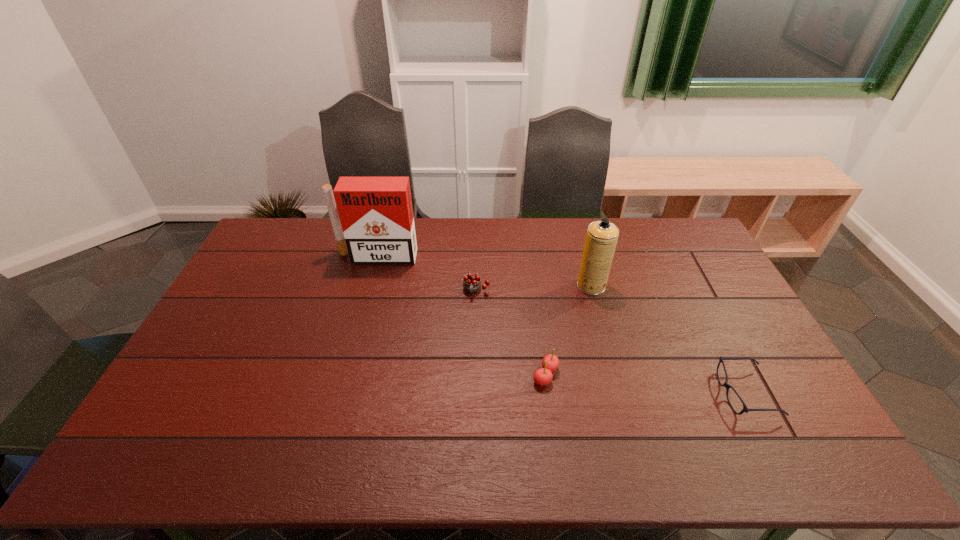
I want to click on free space at the left edge of the desktop, so click(x=234, y=305).

In the image, there is a desktop. In order to click on vacant space at the right edge in this screenshot , I will do `click(711, 303)`.

At what (x,y) coordinates should I click in order to perform the action: click on vacant space at the far left corner of the desktop. Please return your answer as a coordinate pair (x, y). This screenshot has width=960, height=540. Looking at the image, I should click on (270, 251).

The image size is (960, 540). I want to click on free spot between the aerosol can and the rightmost object, so click(668, 339).

Where is `vacant space in between the second object from left to right and the farthest object`? This screenshot has width=960, height=540. vacant space in between the second object from left to right and the farthest object is located at coordinates (427, 274).

Where is `empty space that is in between the aerosol can and the left cherry`? This screenshot has width=960, height=540. empty space that is in between the aerosol can and the left cherry is located at coordinates (534, 288).

I want to click on empty location between the spectacles and the fourth object from left to right, so click(668, 339).

You are a GUI agent. You are given a task and a screenshot of the screen. Output one action in this format:
    pyautogui.click(x=<x>, y=<y>)
    Task: Click on the vacant space that's between the spectacles and the farther cherry
    
    Given the screenshot: What is the action you would take?
    pyautogui.click(x=611, y=342)

Identify the location of blank region between the left cherry and the aerosol can. (534, 288).

Find the location of a particular element. The image size is (960, 540). free point between the aerosol can and the farther cherry is located at coordinates click(x=534, y=288).